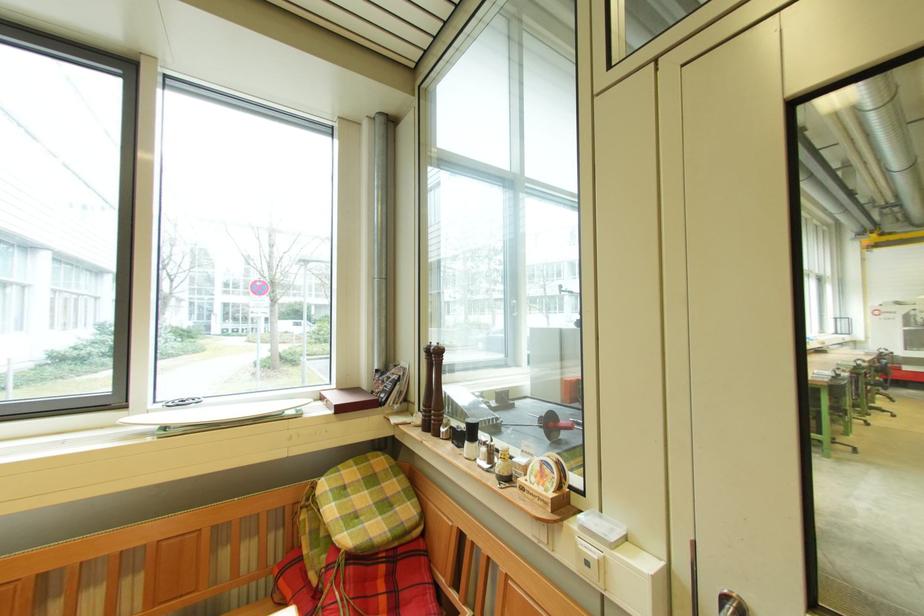
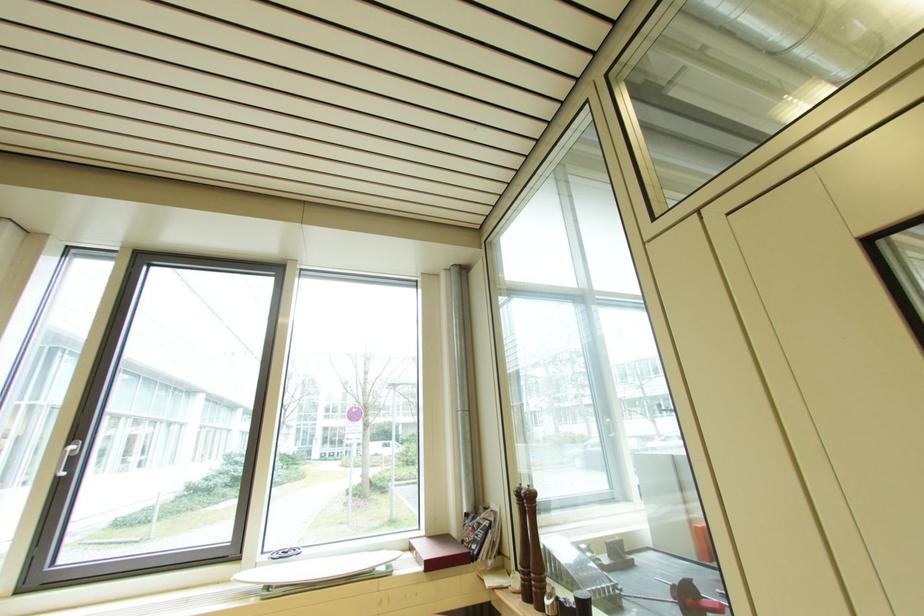
The point at (450, 432) is marked in the first image. Where is the corresponding point in the second image?

(554, 605)